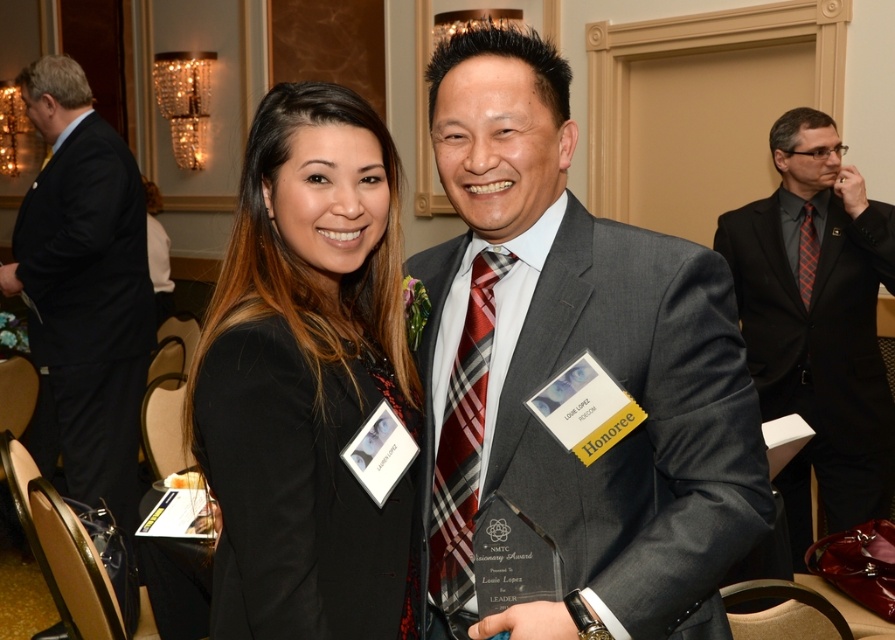
You are a photographer adjusting the lighting for a group photo. You notice the black suit at left and the plaid silk tie at center. Which item requires more space in the frame to capture its full width?

The black suit at left requires more space in the frame to capture its full width because its width is larger than the plaid silk tie at center.

You are a photographer adjusting your camera settings for a group photo. You notice the black suit at left is currently 3.30 meters away from the camera. To ensure the subject is in focus, you need to adjust the focus distance. What should the focus distance be set to?

The focus distance should be set to 3.30 meters to ensure the black suit at left is in focus since it is exactly that distance from the camera.

You are a photographer adjusting the lighting for a group photo. You notice a point at coordinates (817, 324) on your camera screen. What object is located at this point?

The point at coordinates (817, 324) marks the matte black suit at right.